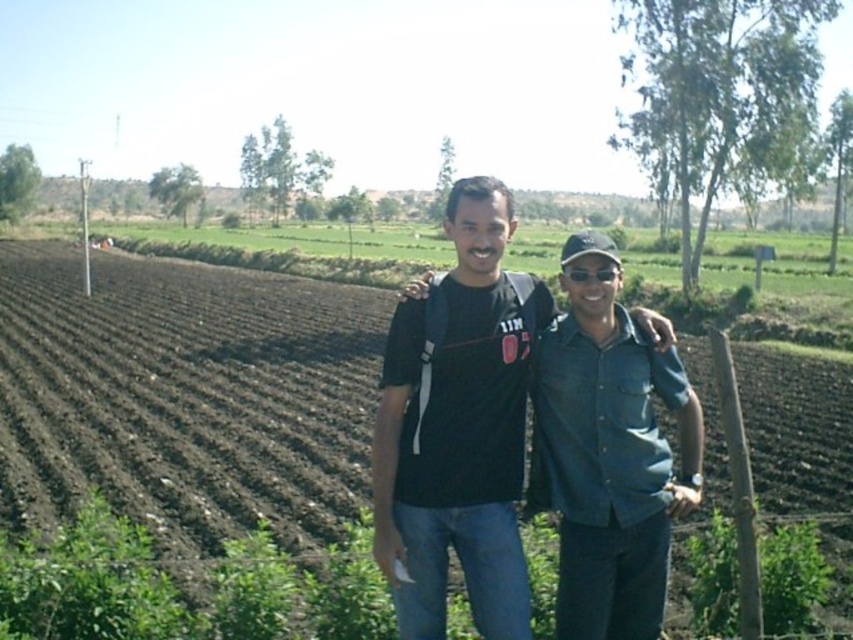
What is the exact coordinate of the dark brown soil at center?

The dark brown soil at center is located at point (184, 396).

You are a photographer trying to capture both the dark brown soil at center and the black matte shirt at center in the same frame. Based on their positions, which object will appear larger in the photo?

The dark brown soil at center will appear larger in the photo because it is much taller than the black matte shirt at center.

You are planning to take a photo of the dark brown soil at center and the black matte shirt at center. Which object occupies a wider area in the image?

The dark brown soil at center has a larger width than the black matte shirt at center, so it occupies a wider area in the image.